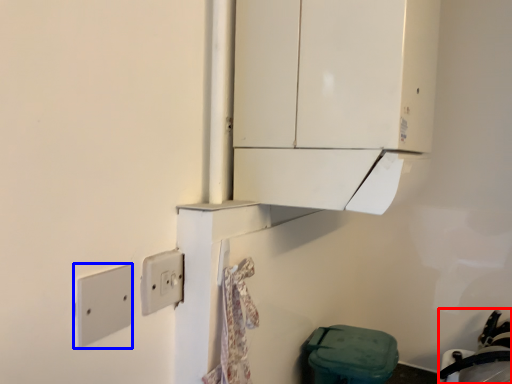
Question: Which object is further to the camera taking this photo, sink (highlighted by a red box) or light switch (highlighted by a blue box)?

Choices:
 (A) sink
 (B) light switch

Answer: (A)